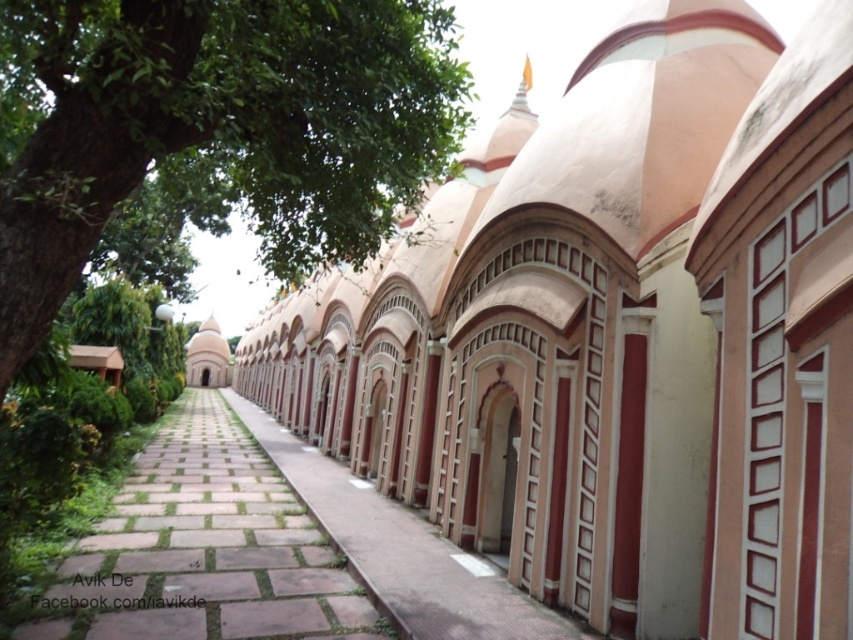
Between point (838, 323) and point (291, 225), which one is positioned behind?

Point (291, 225)

Which is above, pink stone archway at center or green leafy tree at upper left?

green leafy tree at upper left is above.

The image size is (853, 640). What are the coordinates of `pink stone archway at center` in the screenshot? It's located at pos(619,337).

Who is shorter, brown stone path at center or pink stone pathway at center?

pink stone pathway at center is shorter.

Between brown stone path at center and pink stone pathway at center, which one appears on the right side from the viewer's perspective?

Positioned to the right is pink stone pathway at center.

At what (x,y) coordinates should I click in order to perform the action: click on brown stone path at center. Please return your answer as a coordinate pair (x, y). This screenshot has width=853, height=640. Looking at the image, I should click on (202, 548).

Who is more distant from viewer, [683,403] or [326,548]?

The point [326,548] is behind.

Can you confirm if pink stone archway at center is thinner than brown stone path at center?

No, pink stone archway at center is not thinner than brown stone path at center.

Identify the location of pink stone archway at center. The width and height of the screenshot is (853, 640). (619, 337).

Find the location of `pink stone archway at center`. pink stone archway at center is located at coordinates (619, 337).